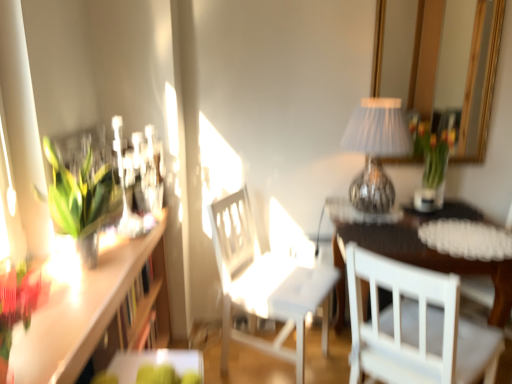
Question: In terms of width, does white wooden chair at lower right, acting as the 1th chair starting from the right, look wider or thinner when compared to translucent glass vase with tulips at upper right?

Choices:
 (A) thin
 (B) wide

Answer: (B)

Question: Is white wooden chair at lower right, acting as the 1th chair starting from the right, bigger or smaller than translucent glass vase with tulips at upper right?

Choices:
 (A) big
 (B) small

Answer: (A)

Question: Which object is the farthest from the translucent glass vase with tulips at upper right?

Choices:
 (A) wooden table at center, the first table in the back-to-front sequence
 (B) white matte chair at center, the 2th chair in the right-to-left sequence
 (C) green plastic tray at lower center, the first table when ordered from left to right
 (D) white wooden chair at lower right, the 2th chair viewed from the left
 (E) wooden shelf at left

Answer: (C)

Question: Estimate the real-world distances between objects in this image. Which object is closer to the wooden shelf at left?

Choices:
 (A) translucent glass vase with tulips at upper right
 (B) wooden table at center, the first table in the back-to-front sequence
 (C) white wooden chair at lower right, acting as the 1th chair starting from the right
 (D) white matte chair at center, the 2th chair in the right-to-left sequence
 (E) green leafy plant at left

Answer: (E)